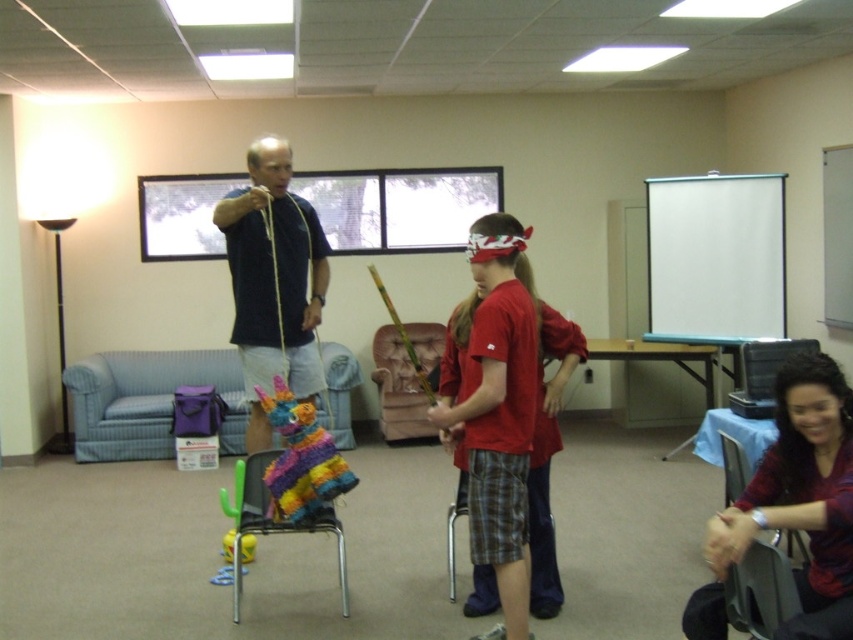
Between red matte shirt at center and gray plastic chair at lower right, which one has less height?

With less height is gray plastic chair at lower right.

Between red matte shirt at center and gray plastic chair at lower right, which one is positioned lower?

gray plastic chair at lower right is below.

The width and height of the screenshot is (853, 640). What do you see at coordinates (498, 413) in the screenshot?
I see `red matte shirt at center` at bounding box center [498, 413].

Locate an element on the screen. The image size is (853, 640). red matte shirt at center is located at coordinates (498, 413).

Is matte red shirt at center below red matte shirt at center?

Yes.

Between matte red shirt at center and red matte shirt at center, which one appears on the left side from the viewer's perspective?

Positioned to the left is red matte shirt at center.

Does point (772, 452) come in front of point (437, 419)?

Yes, point (772, 452) is closer to viewer.

Locate an element on the screen. The height and width of the screenshot is (640, 853). matte red shirt at center is located at coordinates (793, 506).

Is point (282, 508) farther from camera compared to point (257, 481)?

No, it is in front of (257, 481).

From the picture: Is multicolored paper pinata at center to the left of multicolored fabric pinata at center from the viewer's perspective?

In fact, multicolored paper pinata at center is to the right of multicolored fabric pinata at center.

What are the coordinates of `multicolored paper pinata at center` in the screenshot? It's located at (300, 460).

Image resolution: width=853 pixels, height=640 pixels. I want to click on multicolored paper pinata at center, so click(x=300, y=460).